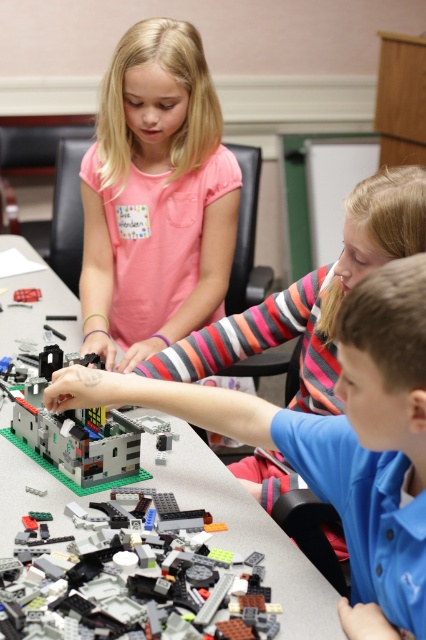
You are a child participating in the LEGO building activity at the table. You see the translucent gray plastic building at center represented by point (75, 435). Where exactly is this point located on the building?

The translucent gray plastic building at center is represented by point (75, 435), which indicates its central position on the building.

You are a child trying to reach the translucent plastic lego at center from your position at the green plastic table at center. Can you easily reach it without moving your hands?

The green plastic table at center is in front of the translucent plastic lego at center, so the lego is behind the table. You would need to move your hands over or around the table to reach it.

You are a child trying to pick up the translucent plastic lego at center from the green plastic table at center. Can you reach it without moving your hands below the table?

The green plastic table at center is located below the translucent plastic lego at center, so yes, you can reach it without moving your hands below the table since the lego is above the table.